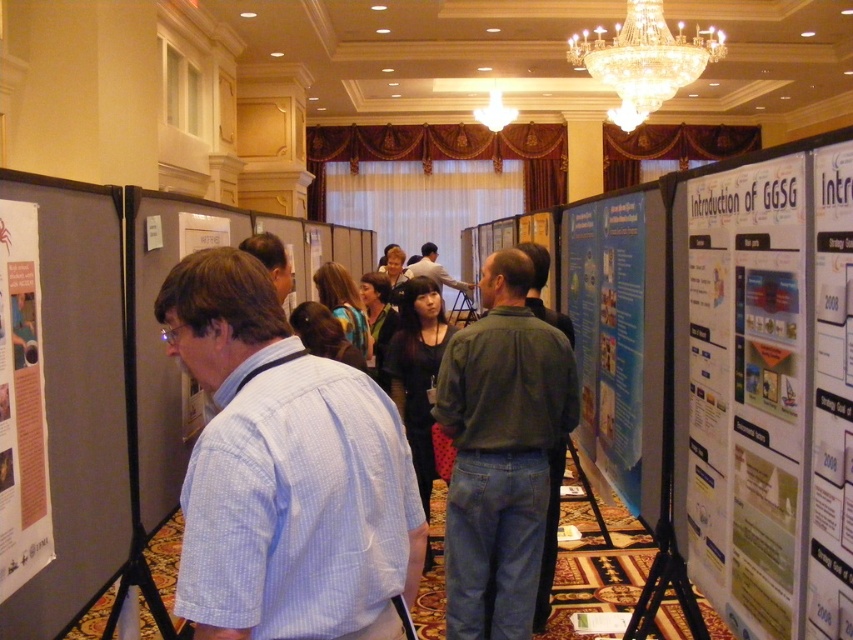
You are standing at the entrance of the conference room and see two points marked on the floor. The first point is labeled as point (358, 582) and the second as point (26, 433). Which point is closer to you?

Point (358, 582) is in front of point (26, 433), so it is closer to you.

You are standing at the point marked as point (22, 368) in the conference room. You want to take a photo of the posters displayed on the stands. Considering your camera has a maximum focus range of 1.5 meters, will you be able to capture a clear image of the posters?

The distance between point (22, 368) and the camera is 1.71 meters. Since the camera can only focus up to 1.5 meters, you will not be able to capture a clear image of the posters from that position.